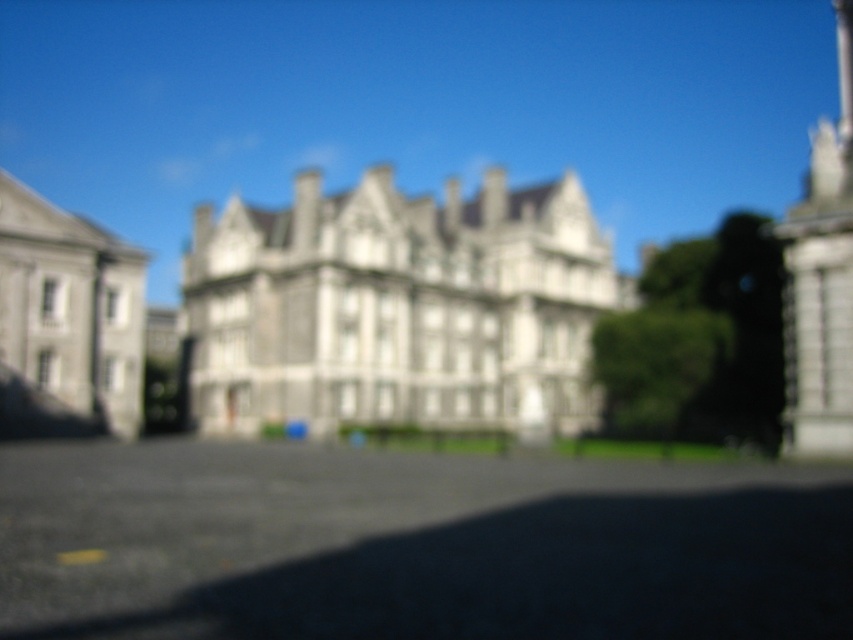
Which of these two, white stone building at center or gray stone building at left, stands taller?

With more height is white stone building at center.

Between white stone building at center and gray stone building at left, which one appears on the right side from the viewer's perspective?

Positioned to the right is white stone building at center.

Is point (194, 321) behind point (140, 362)?

Yes.

Find the location of a particular element. white stone building at center is located at coordinates (399, 308).